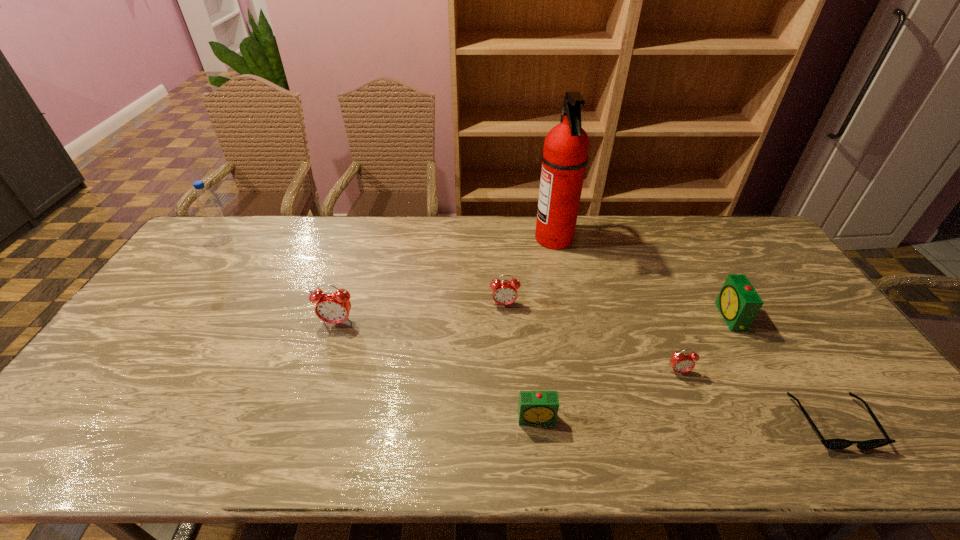
You are a GUI agent. You are given a task and a screenshot of the screen. Output one action in this format:
    pyautogui.click(x=<x>, y=<y>)
    Task: Click on the vacant space that is in between the second smallest red alarm clock and the rightmost alarm clock
    This screenshot has width=960, height=540.
    Given the screenshot: What is the action you would take?
    pyautogui.click(x=617, y=311)

Where is `vacant area that lies between the second tallest object and the sunglasses`? vacant area that lies between the second tallest object and the sunglasses is located at coordinates (528, 331).

At what (x,y) coordinates should I click in order to perform the action: click on empty space between the black sunglasses and the fifth object from left to right. Please return your answer as a coordinate pair (x, y). This screenshot has width=960, height=540. Looking at the image, I should click on (693, 330).

Find the location of a particular element. empty space that is in between the farther green alarm clock and the second smallest red alarm clock is located at coordinates (617, 311).

Image resolution: width=960 pixels, height=540 pixels. Identify the location of free space between the tallest object and the second object from left to right. (445, 281).

You are a GUI agent. You are given a task and a screenshot of the screen. Output one action in this format:
    pyautogui.click(x=<x>, y=<y>)
    Task: Click on the free space between the farthest red alarm clock and the leftmost object
    
    Given the screenshot: What is the action you would take?
    pyautogui.click(x=365, y=272)

At what (x,y) coordinates should I click in order to perform the action: click on free space that is in between the left green alarm clock and the farther green alarm clock. Please return your answer as a coordinate pair (x, y). The width and height of the screenshot is (960, 540). Looking at the image, I should click on (634, 368).

Locate an element on the screen. This screenshot has height=540, width=960. free space between the seventh shortest object and the left green alarm clock is located at coordinates (381, 329).

The width and height of the screenshot is (960, 540). I want to click on free point between the sunglasses and the rightmost alarm clock, so click(781, 369).

Image resolution: width=960 pixels, height=540 pixels. Identify the location of object that stands as the second closest to the rightmost alarm clock. (835, 444).